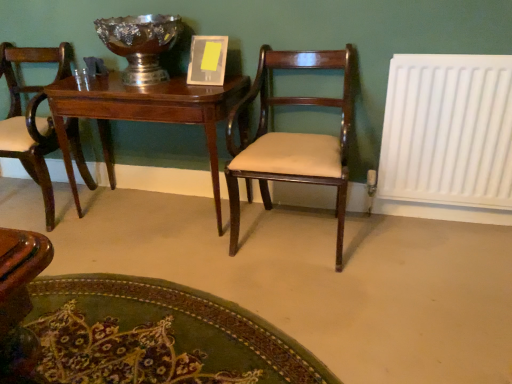
Question: Is mahogany wood chair at center, acting as the first chair starting from the right, wider than mahogany wood table at center?

Choices:
 (A) no
 (B) yes

Answer: (B)

Question: Is mahogany wood chair at center, which is the 2th chair in left-to-right order, positioned with its back to mahogany wood table at center?

Choices:
 (A) no
 (B) yes

Answer: (A)

Question: Is mahogany wood chair at center, acting as the first chair starting from the right, outside of mahogany wood table at center?

Choices:
 (A) no
 (B) yes

Answer: (B)

Question: Considering the relative sizes of mahogany wood chair at center, which is the 2th chair in left-to-right order, and mahogany wood table at center in the image provided, is mahogany wood chair at center, which is the 2th chair in left-to-right order, smaller than mahogany wood table at center?

Choices:
 (A) yes
 (B) no

Answer: (A)

Question: Is mahogany wood chair at center, acting as the first chair starting from the right, further to camera compared to mahogany wood table at center?

Choices:
 (A) yes
 (B) no

Answer: (B)

Question: From a real-world perspective, relative to matte wood chair at left, the first chair positioned from the left, is mahogany wood table at center vertically above or below?

Choices:
 (A) above
 (B) below

Answer: (B)

Question: Considering the positions of mahogany wood table at center and matte wood chair at left, the first chair positioned from the left, in the image, is mahogany wood table at center taller or shorter than matte wood chair at left, the first chair positioned from the left,?

Choices:
 (A) short
 (B) tall

Answer: (A)

Question: In terms of width, does mahogany wood table at center look wider or thinner when compared to matte wood chair at left, the first chair positioned from the left?

Choices:
 (A) wide
 (B) thin

Answer: (B)

Question: Considering the positions of mahogany wood table at center and matte wood chair at left, the first chair positioned from the left, in the image, is mahogany wood table at center bigger or smaller than matte wood chair at left, the first chair positioned from the left,?

Choices:
 (A) small
 (B) big

Answer: (B)

Question: In terms of height, does mahogany wood table at center look taller or shorter compared to mahogany wood chair at center, acting as the first chair starting from the right?

Choices:
 (A) short
 (B) tall

Answer: (A)

Question: Is mahogany wood table at center in front of or behind mahogany wood chair at center, which is the 2th chair in left-to-right order, in the image?

Choices:
 (A) behind
 (B) front

Answer: (A)

Question: From a real-world perspective, is mahogany wood table at center physically located above or below mahogany wood chair at center, acting as the first chair starting from the right?

Choices:
 (A) above
 (B) below

Answer: (B)

Question: From the image's perspective, relative to mahogany wood chair at center, which is the 2th chair in left-to-right order, is mahogany wood table at center above or below?

Choices:
 (A) below
 (B) above

Answer: (B)

Question: Relative to white plastic radiator at right, is matte wood chair at left, the first chair positioned from the left, in front or behind?

Choices:
 (A) behind
 (B) front

Answer: (A)

Question: Based on their positions, is matte wood chair at left, marked as the 2th chair in a right-to-left arrangement, located to the left or right of white plastic radiator at right?

Choices:
 (A) left
 (B) right

Answer: (A)